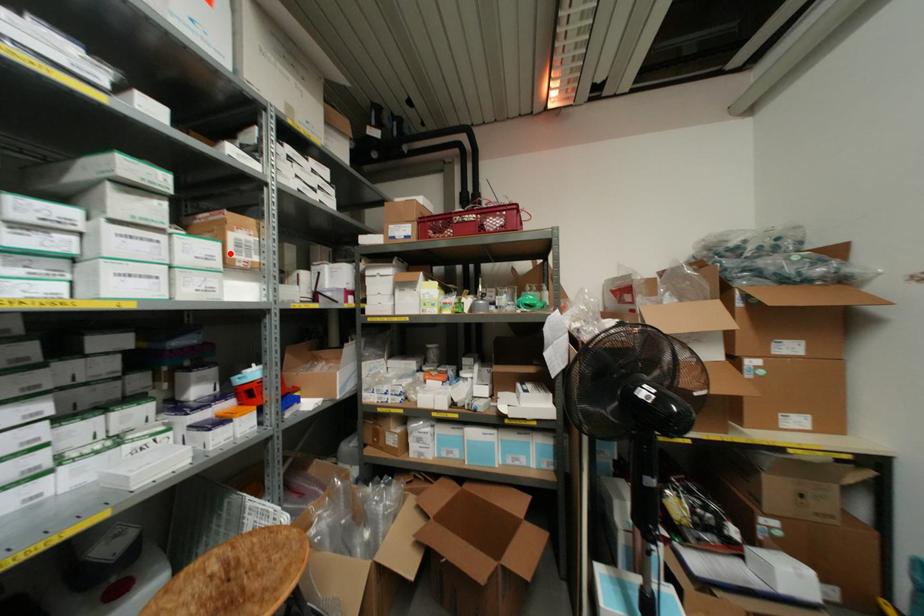
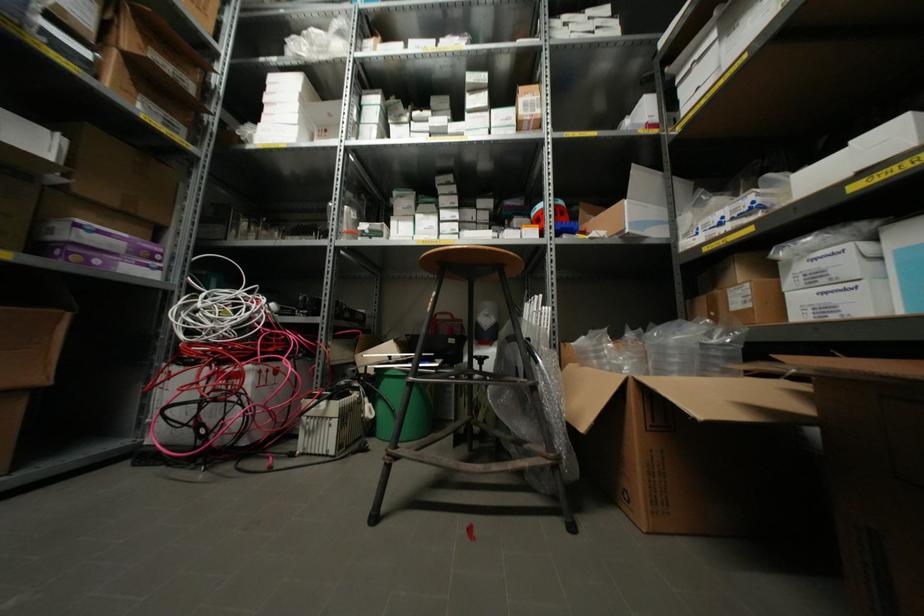
The point at the highlighted location is marked in the first image. Where is the corresponding point in the second image?

(519, 111)